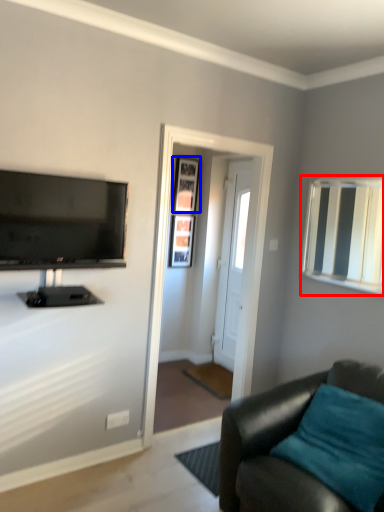
Question: Which of the following is the farthest to the observer, mirror (highlighted by a red box) or picture frame (highlighted by a blue box)?

Choices:
 (A) mirror
 (B) picture frame

Answer: (B)